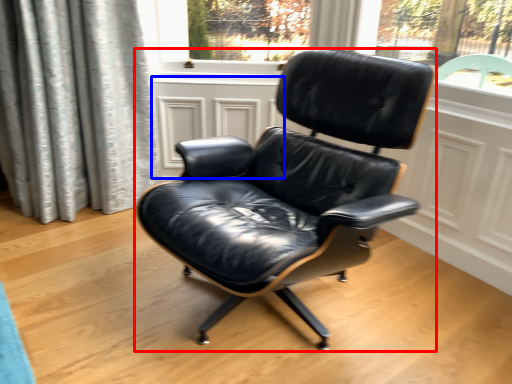
Question: Which object appears farthest to the camera in this image, chair (highlighted by a red box) or screen door (highlighted by a blue box)?

Choices:
 (A) chair
 (B) screen door

Answer: (B)